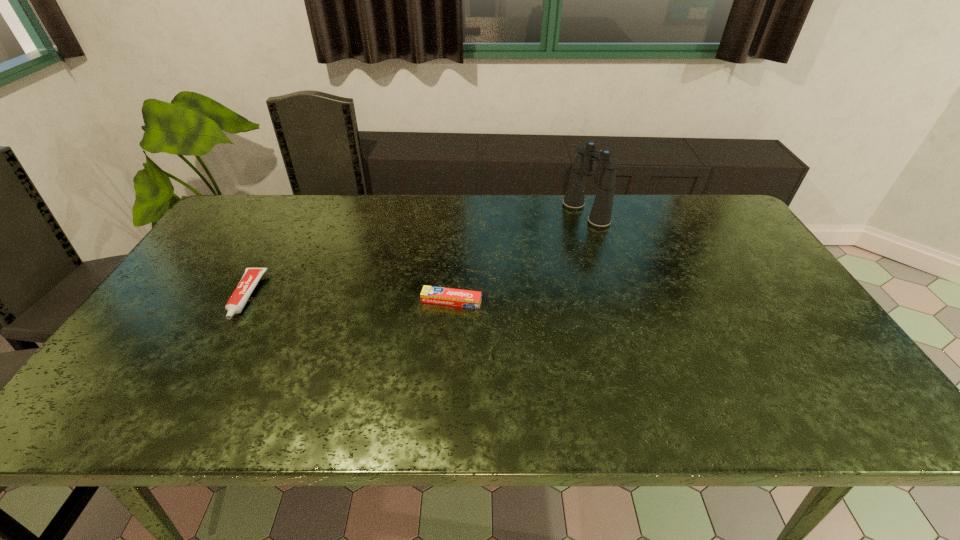
Image resolution: width=960 pixels, height=540 pixels. In order to click on vacant region that satisfies the following two spatial constraints: 1. at the nozzle of the leftmost object; 2. on the left side of the second object from left to right in this screenshot , I will do `click(244, 301)`.